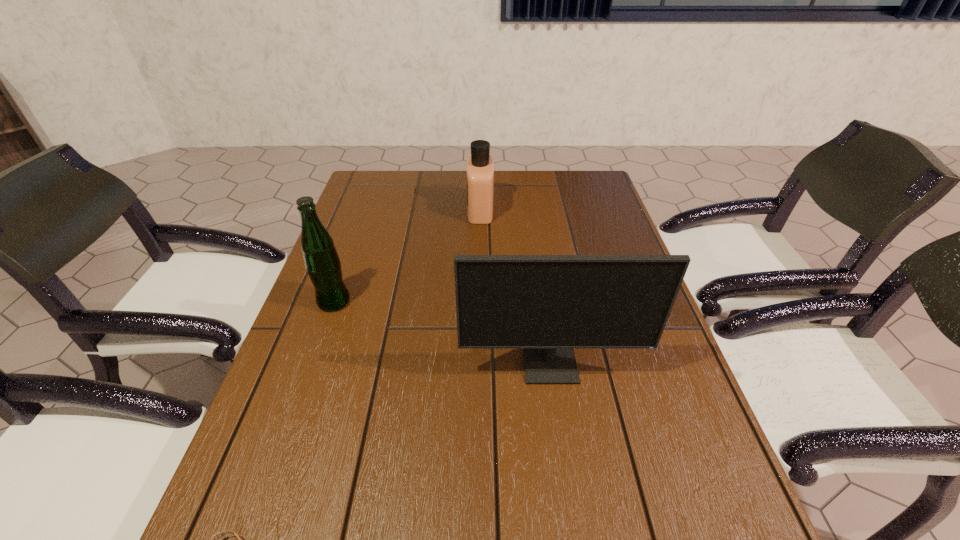
What are the coordinates of `object positioned at the left edge` in the screenshot? It's located at (322, 262).

The height and width of the screenshot is (540, 960). What are the coordinates of `object at the right edge` in the screenshot? It's located at (548, 305).

The height and width of the screenshot is (540, 960). I want to click on free point at the far edge, so click(x=525, y=201).

You are a GUI agent. You are given a task and a screenshot of the screen. Output one action in this format:
    pyautogui.click(x=<x>, y=<y>)
    Task: Click on the vacant space at the left edge of the desktop
    
    Given the screenshot: What is the action you would take?
    pyautogui.click(x=304, y=348)

Find the location of `free spot at the right edge of the desktop`. free spot at the right edge of the desktop is located at coordinates (613, 374).

Where is `vacant space at the far right corner`? The height and width of the screenshot is (540, 960). vacant space at the far right corner is located at coordinates (588, 179).

Locate an element on the screen. Image resolution: width=960 pixels, height=540 pixels. free space between the second farthest object and the computer monitor is located at coordinates (443, 334).

Where is `blank region between the second nearest object and the beer bottle`? This screenshot has height=540, width=960. blank region between the second nearest object and the beer bottle is located at coordinates point(443,334).

Choose which object is the third nearest neighbor to the second farthest object. Please provide its 2D coordinates. Your answer should be formatted as a tuple, i.e. [(x, y)], where the tuple contains the x and y coordinates of a point satisfying the conditions above.

[(214, 539)]

Find the location of `object that stands as the third closest to the watch`. object that stands as the third closest to the watch is located at coordinates (480, 168).